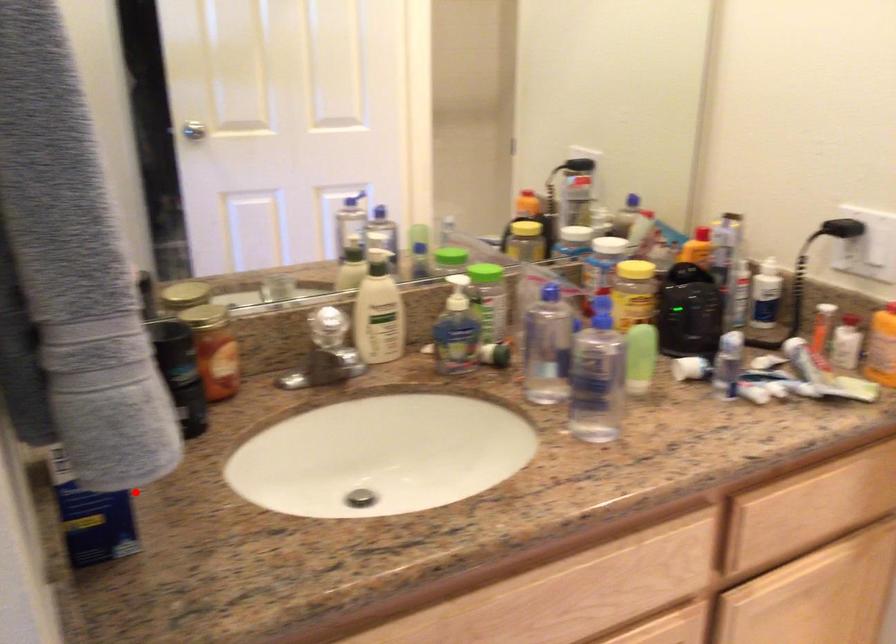
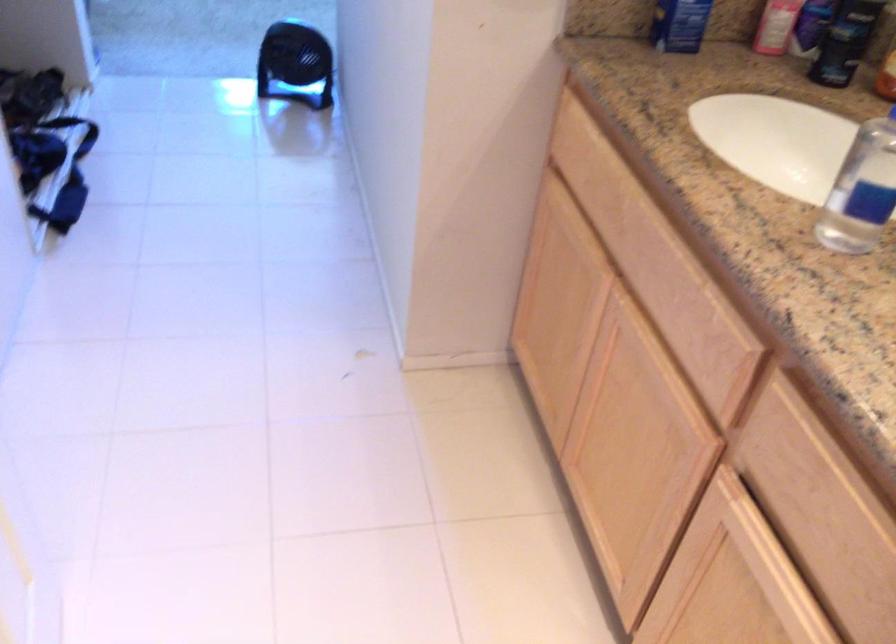
Locate, in the second image, the point that corresponds to the highlighted location in the first image.

(679, 24)